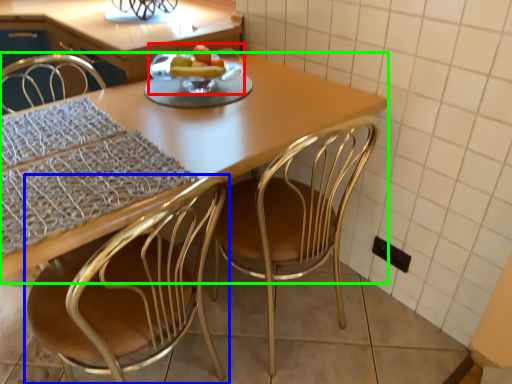
Question: Based on their relative distances, which object is farther from fruit dish (highlighted by a red box)? Choose from chair (highlighted by a blue box) and kitchen & dining room table (highlighted by a green box).

Choices:
 (A) chair
 (B) kitchen & dining room table

Answer: (A)